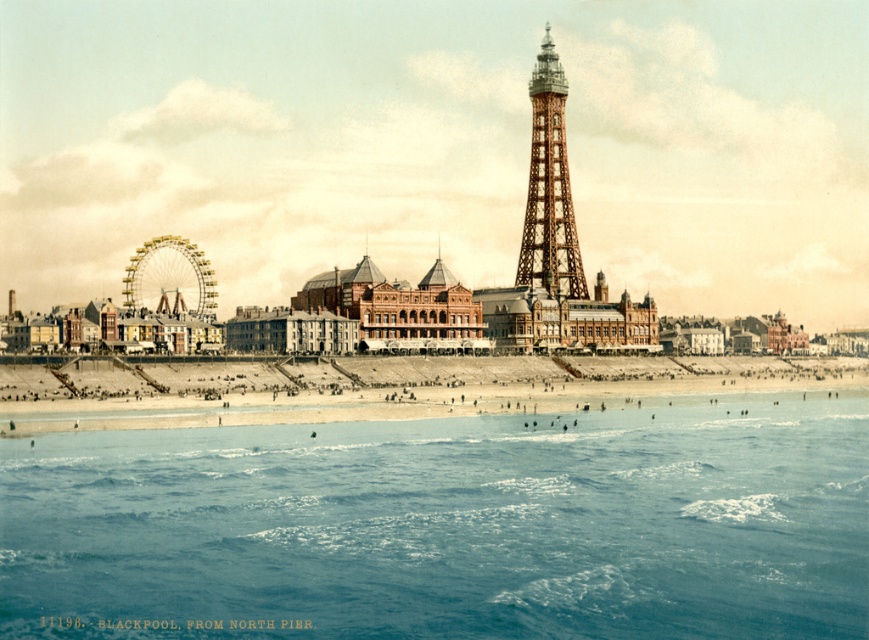
Consider the image. Who is more distant from viewer, [688,378] or [565,88]?

The point [565,88] is behind.

Can you confirm if beige sand beach at lower center is positioned to the left of brown wooden lattice tower at center-right?

In fact, beige sand beach at lower center is to the right of brown wooden lattice tower at center-right.

At what (x,y) coordinates should I click in order to perform the action: click on beige sand beach at lower center. Please return your answer as a coordinate pair (x, y). The image size is (869, 640). Looking at the image, I should click on (413, 390).

Can you confirm if brown wooden lattice tower at center-right is positioned to the right of gold metallic ferris wheel at left?

Correct, you'll find brown wooden lattice tower at center-right to the right of gold metallic ferris wheel at left.

Is point (551, 56) behind point (191, 307)?

Yes.

The width and height of the screenshot is (869, 640). What do you see at coordinates (549, 188) in the screenshot? I see `brown wooden lattice tower at center-right` at bounding box center [549, 188].

You are a GUI agent. You are given a task and a screenshot of the screen. Output one action in this format:
    pyautogui.click(x=<x>, y=<y>)
    Task: Click on the brown wooden lattice tower at center-right
    
    Given the screenshot: What is the action you would take?
    pyautogui.click(x=549, y=188)

Is metallic ferris wheel at center left positioned behind brown wooden lattice tower at center-right?

No, it is not.

Can you confirm if metallic ferris wheel at center left is shorter than brown wooden lattice tower at center-right?

Correct, metallic ferris wheel at center left is not as tall as brown wooden lattice tower at center-right.

Does point (751, 381) come farther from viewer compared to point (523, 266)?

No, (751, 381) is closer to viewer.

Locate an element on the screen. Image resolution: width=869 pixels, height=640 pixels. metallic ferris wheel at center left is located at coordinates (400, 368).